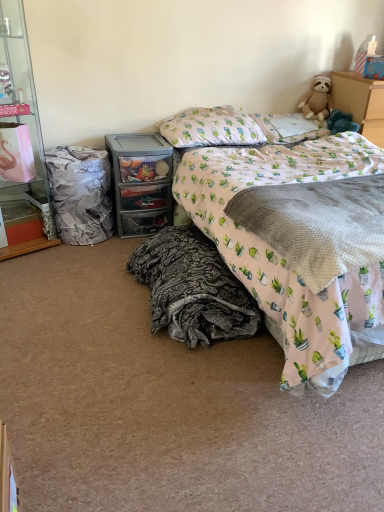
Question: Is cactus-patterned fabric pillow at upper right, the 2th pillow viewed from the left, at the back of pink fabric bed at center?

Choices:
 (A) no
 (B) yes

Answer: (A)

Question: Can cactus-patterned fabric pillow at upper right, which appears as the 1th pillow when viewed from the right, be found inside pink fabric bed at center?

Choices:
 (A) no
 (B) yes

Answer: (B)

Question: Can you confirm if pink fabric bed at center is positioned to the left of cactus-patterned fabric pillow at upper right, the 2th pillow viewed from the left?

Choices:
 (A) no
 (B) yes

Answer: (A)

Question: Is pink fabric bed at center not within cactus-patterned fabric pillow at upper right, the 2th pillow viewed from the left?

Choices:
 (A) yes
 (B) no

Answer: (A)

Question: From a real-world perspective, is pink fabric bed at center on top of cactus-patterned fabric pillow at upper right, which appears as the 1th pillow when viewed from the right?

Choices:
 (A) yes
 (B) no

Answer: (B)

Question: Looking at their shapes, would you say marble-patterned laundry basket at left is wider or thinner than fluffy beige teddy bear at upper right?

Choices:
 (A) wide
 (B) thin

Answer: (A)

Question: Is marble-patterned laundry basket at left inside or outside of fluffy beige teddy bear at upper right?

Choices:
 (A) inside
 (B) outside

Answer: (B)

Question: Is marble-patterned laundry basket at left in front of or behind fluffy beige teddy bear at upper right in the image?

Choices:
 (A) front
 (B) behind

Answer: (A)

Question: From their relative heights in the image, would you say marble-patterned laundry basket at left is taller or shorter than fluffy beige teddy bear at upper right?

Choices:
 (A) short
 (B) tall

Answer: (B)

Question: From their relative heights in the image, would you say dark gray textured blanket at lower center, which is the 1th blanket from left to right, is taller or shorter than clear glass cabinet at left?

Choices:
 (A) tall
 (B) short

Answer: (B)

Question: Is dark gray textured blanket at lower center, the second blanket viewed from the right, spatially inside clear glass cabinet at left, or outside of it?

Choices:
 (A) outside
 (B) inside

Answer: (A)

Question: From a real-world perspective, relative to clear glass cabinet at left, is dark gray textured blanket at lower center, which is the 1th blanket from left to right, vertically above or below?

Choices:
 (A) below
 (B) above

Answer: (A)

Question: Is dark gray textured blanket at lower center, the second blanket viewed from the right, bigger or smaller than clear glass cabinet at left?

Choices:
 (A) big
 (B) small

Answer: (B)

Question: From a real-world perspective, is pink fabric bed at center above or below pillow at upper center, which is counted as the second pillow, starting from the right?

Choices:
 (A) above
 (B) below

Answer: (B)

Question: Is pink fabric bed at center taller or shorter than pillow at upper center, which is counted as the second pillow, starting from the right?

Choices:
 (A) short
 (B) tall

Answer: (B)